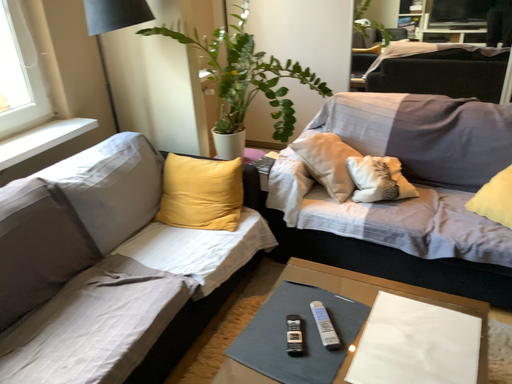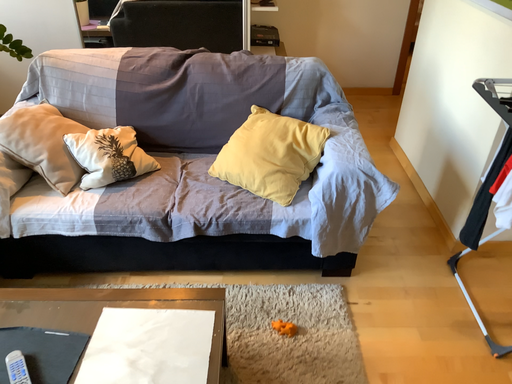
Question: Which way did the camera rotate in the video?

Choices:
 (A) rotated left
 (B) rotated right

Answer: (B)